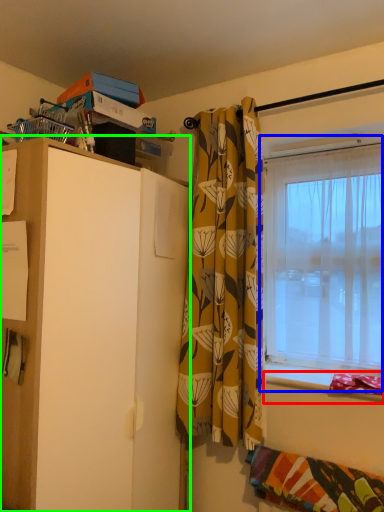
Question: Which object is the farthest from window sill (highlighted by a red box)? Choose among these: window (highlighted by a blue box) or cabinetry (highlighted by a green box).

Choices:
 (A) window
 (B) cabinetry

Answer: (B)